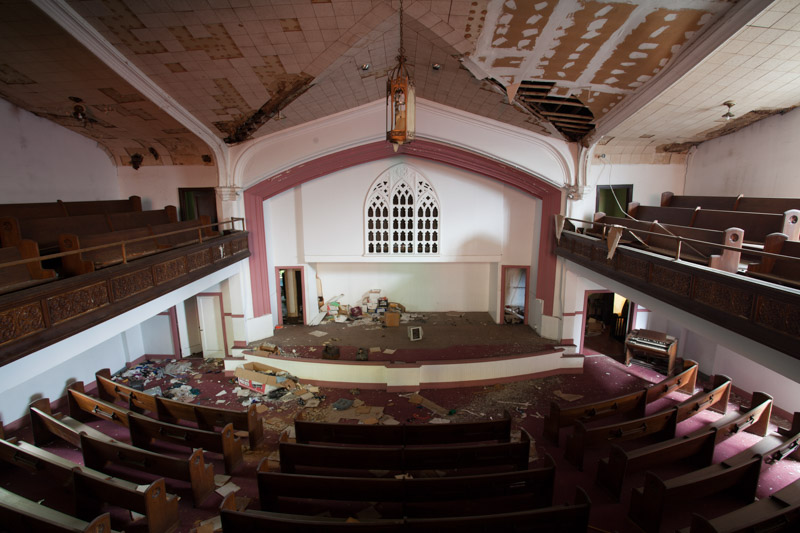
The height and width of the screenshot is (533, 800). Identify the location of stage. (470, 351).